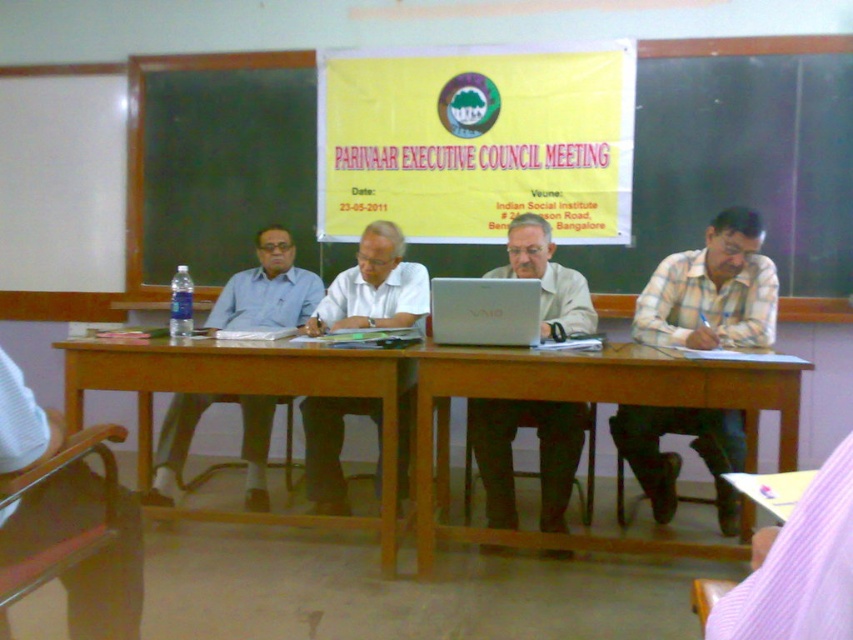
Question: Is wooden table at center below white matte shirt at center?

Choices:
 (A) no
 (B) yes

Answer: (B)

Question: Which object appears closest to the camera in this image?

Choices:
 (A) matte blue shirt at left
 (B) white matte shirt at center
 (C) plaid cotton shirt at right
 (D) purple striped shirt at lower right

Answer: (D)

Question: Estimate the real-world distances between objects in this image. Which object is farther from the matte blue shirt at left?

Choices:
 (A) white matte shirt at center
 (B) silver metallic laptop at center

Answer: (B)

Question: Which of the following is the closest to the observer?

Choices:
 (A) (242, 323)
 (B) (508, 323)

Answer: (B)

Question: Can you confirm if plaid cotton shirt at right is wider than matte blue shirt at left?

Choices:
 (A) yes
 (B) no

Answer: (A)

Question: Does matte white laptop at center appear on the left side of yellow paper at upper center?

Choices:
 (A) no
 (B) yes

Answer: (A)